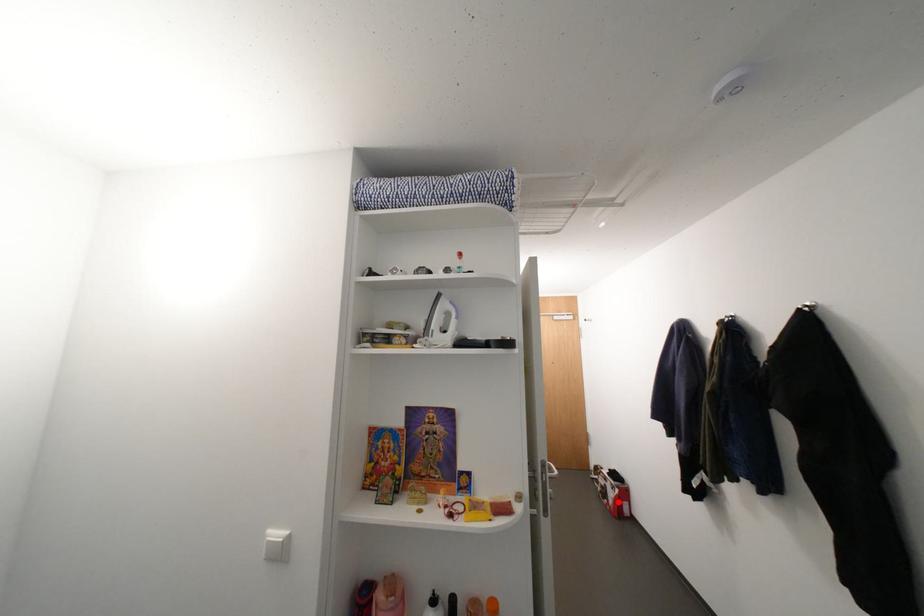
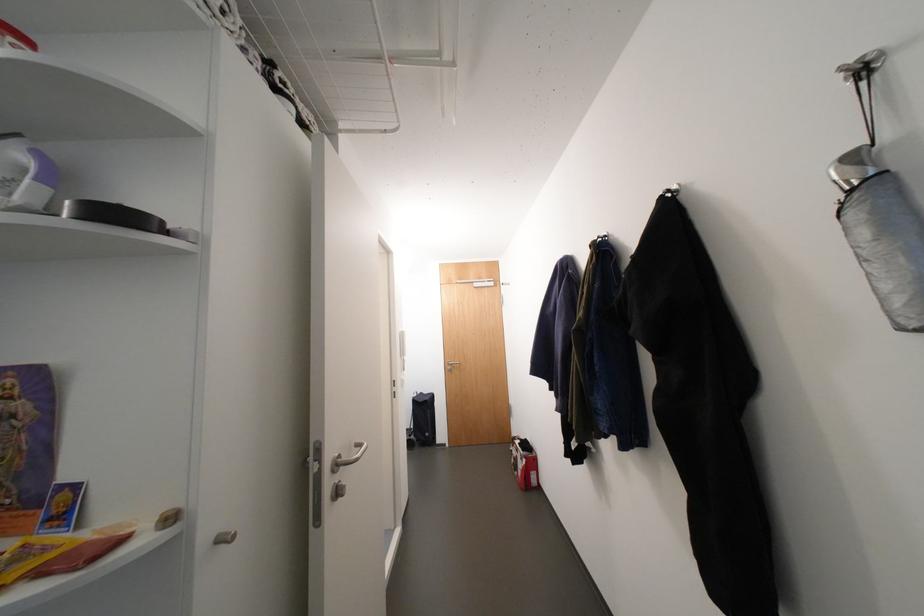
Find the pixel in the second image that matches the highlighted location in the first image.

(527, 474)